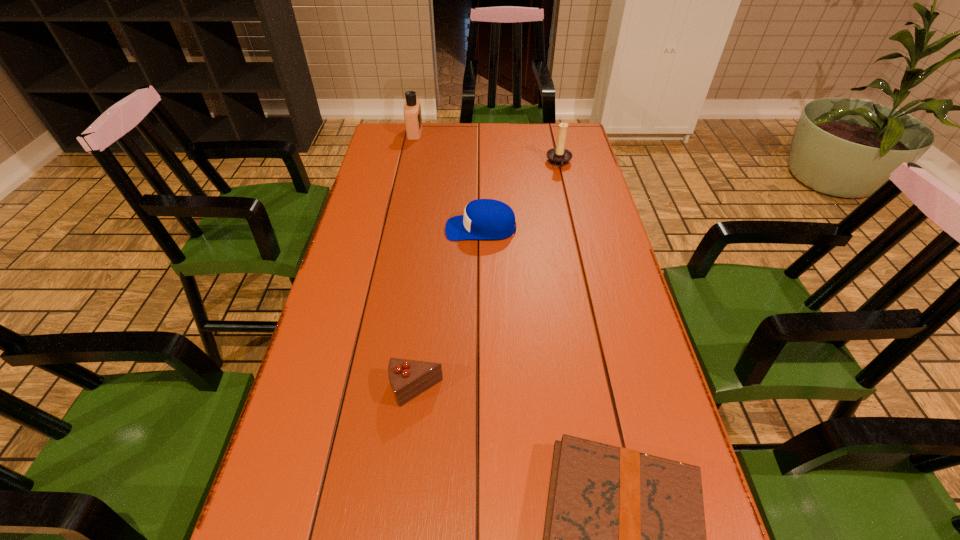
What are the coordinates of `unoccupied position between the baseball cap and the chocolate cake` in the screenshot? It's located at [x=449, y=309].

The height and width of the screenshot is (540, 960). I want to click on free space between the leftmost object and the fourth farthest object, so click(416, 261).

Where is `unoccupied area between the third farthest object and the fourth nearest object`? This screenshot has height=540, width=960. unoccupied area between the third farthest object and the fourth nearest object is located at coordinates (520, 196).

This screenshot has height=540, width=960. I want to click on blank region between the fourth nearest object and the second nearest object, so click(x=488, y=276).

Identify the location of free spot between the third farthest object and the fourth farthest object. (449, 309).

Find the location of `free space that is in between the baseball cap and the second farthest object`. free space that is in between the baseball cap and the second farthest object is located at coordinates (520, 196).

The width and height of the screenshot is (960, 540). In order to click on vacant area between the baseball cap and the fourth farthest object in this screenshot , I will do `click(449, 309)`.

Where is `vacant space in between the third nearest object and the leftmost object`? vacant space in between the third nearest object and the leftmost object is located at coordinates (448, 181).

Where is `object that is the second closest to the candle holder`? object that is the second closest to the candle holder is located at coordinates (412, 109).

Identify which object is the second closest to the nearest object. Please provide its 2D coordinates. Your answer should be formatted as a tuple, i.e. [(x, y)], where the tuple contains the x and y coordinates of a point satisfying the conditions above.

[(484, 219)]